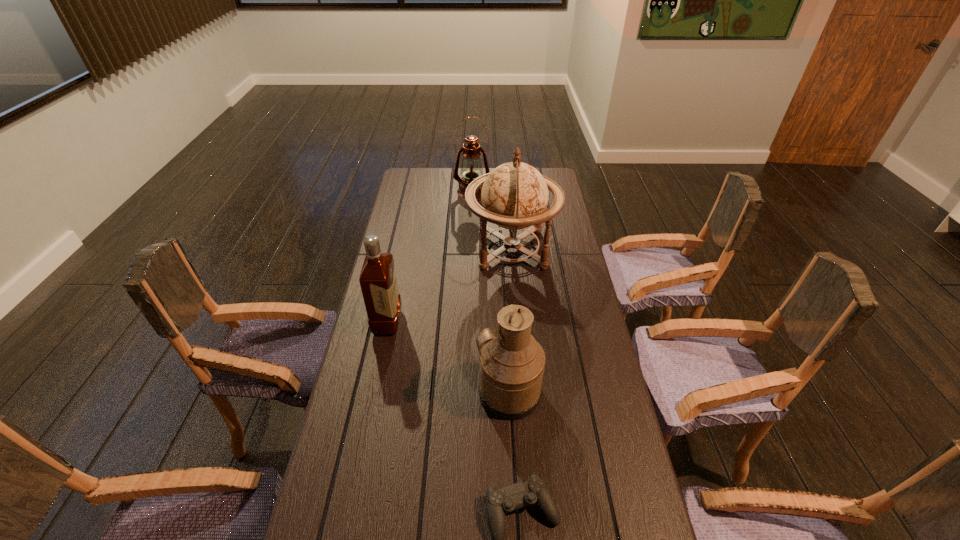
The image size is (960, 540). I want to click on empty space that is in between the liquor and the farthest object, so 430,257.

This screenshot has width=960, height=540. In order to click on unoccupied position between the globe and the third nearest object in this screenshot , I will do `click(449, 286)`.

Locate an element on the screen. empty location between the third nearest object and the tallest object is located at coordinates (449, 286).

The height and width of the screenshot is (540, 960). Find the location of `free area in between the third nearest object and the oil lamp`. free area in between the third nearest object and the oil lamp is located at coordinates (430, 257).

At what (x,y) coordinates should I click in order to perform the action: click on vacant space that's between the leftmost object and the second nearest object. Please return your answer as a coordinate pair (x, y). The width and height of the screenshot is (960, 540). Looking at the image, I should click on (448, 358).

The height and width of the screenshot is (540, 960). I want to click on free spot between the second farthest object and the liquor, so click(449, 286).

Where is `the second closest object relative to the leftmost object`? the second closest object relative to the leftmost object is located at coordinates (512, 363).

You are a GUI agent. You are given a task and a screenshot of the screen. Output one action in this format:
    pyautogui.click(x=<x>, y=<y>)
    Task: Click on the object that is the closest to the farthest object
    This screenshot has width=960, height=540.
    Given the screenshot: What is the action you would take?
    pyautogui.click(x=514, y=196)

At what (x,y) coordinates should I click in order to perform the action: click on free spot that satisfies the following two spatial constraints: 1. on the front side of the oil lamp; 2. on the front label of the leftmost object. Please return your answer as a coordinate pair (x, y). Looking at the image, I should click on (468, 322).

You are a GUI agent. You are given a task and a screenshot of the screen. Output one action in this format:
    pyautogui.click(x=<x>, y=<y>)
    Task: Click on the free space that satisfies the following two spatial constraints: 1. on the front side of the farthest object; 2. on the front label of the third farthest object
    
    Given the screenshot: What is the action you would take?
    pyautogui.click(x=468, y=322)